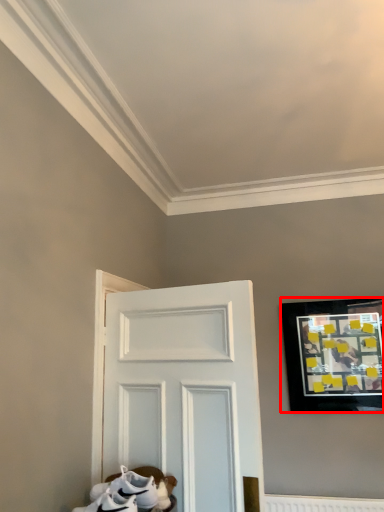
Question: From the image's perspective, where is picture frame (annotated by the red box) located in relation to footwear in the image?

Choices:
 (A) above
 (B) below

Answer: (A)